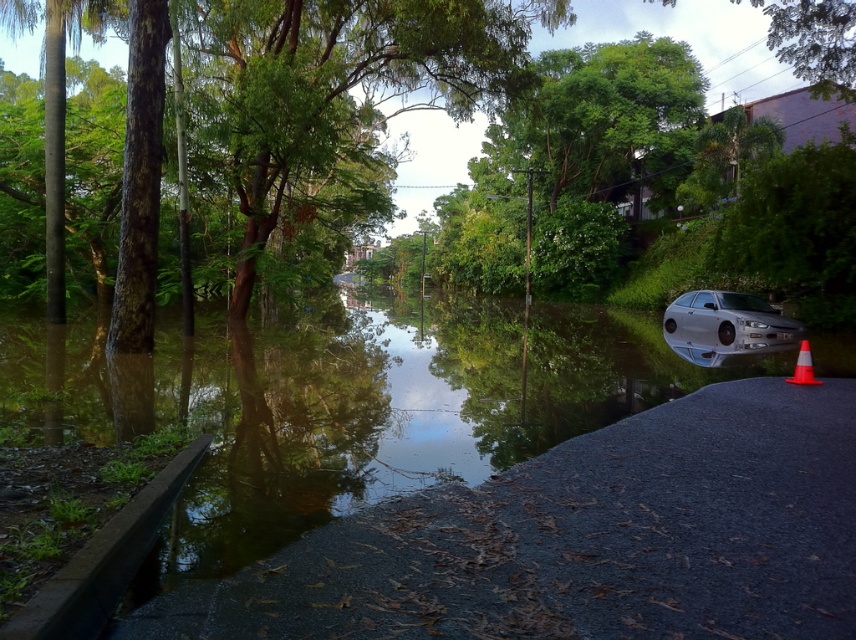
You are a pedestrian trying to cross the flooded street. The clear water at road right and the silver metallic car at lower right are in your path. Given that the water depth at the car is 2 feet, and the distance between them is 19.80 feet, can you safely walk from the car to the water area without wading through deeper water?

The clear water at road right is 19.80 feet away from the silver metallic car at lower right. Since the water depth at the car is 2 feet, and there is no information about deeper areas between them, it is possible to walk safely between them, assuming the depth remains consistent or decreases.

You are a delivery person needing to cross the flooded street. You see the silver metallic car at lower right and the orange reflective cone at lower right. Which object is farther away from you if you are standing at the edge of the flooded area?

The silver metallic car at lower right is farther away from you than the orange reflective cone at lower right because the distance between them is 27.12 feet.

You are a pedestrian trying to cross the flooded street. You see the silver metallic car at lower right and the orange reflective cone at lower right. Which object is larger in size?

The silver metallic car at lower right is bigger than the orange reflective cone at lower right, so the car is larger in size.